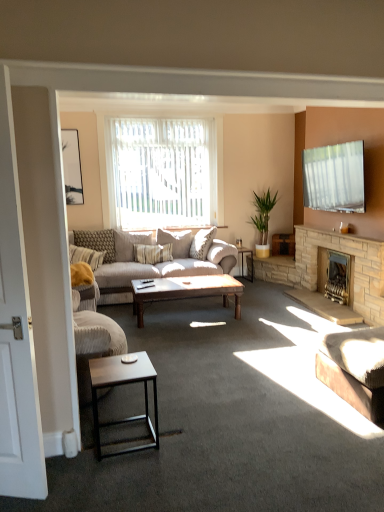
Question: In which direction should I rotate to look at textured beige pillow at center, the 2th pillow viewed from the left?

Choices:
 (A) left
 (B) right

Answer: (A)

Question: Is the depth of matte black picture frame at upper left less than that of black wood side table at center?

Choices:
 (A) yes
 (B) no

Answer: (A)

Question: Is the position of matte black picture frame at upper left more distant than that of black wood side table at center?

Choices:
 (A) yes
 (B) no

Answer: (B)

Question: From a real-world perspective, is matte black picture frame at upper left physically below black wood side table at center?

Choices:
 (A) no
 (B) yes

Answer: (A)

Question: Is matte black picture frame at upper left at the right side of black wood side table at center?

Choices:
 (A) yes
 (B) no

Answer: (B)

Question: Is matte black picture frame at upper left to the left of black wood side table at center from the viewer's perspective?

Choices:
 (A) yes
 (B) no

Answer: (A)

Question: From the image's perspective, is matte black picture frame at upper left above black wood side table at center?

Choices:
 (A) yes
 (B) no

Answer: (A)

Question: Can you confirm if wooden coffee table at center, marked as the 1th coffee table in a back-to-front arrangement, is thinner than textured beige pillow at left, the first pillow from the left?

Choices:
 (A) no
 (B) yes

Answer: (A)

Question: Could you tell me if wooden coffee table at center, acting as the 2th coffee table starting from the front, is facing textured beige pillow at left, the 3th pillow in the right-to-left sequence?

Choices:
 (A) no
 (B) yes

Answer: (A)

Question: From a real-world perspective, is wooden coffee table at center, marked as the 1th coffee table in a back-to-front arrangement, over textured beige pillow at left, the 3th pillow in the right-to-left sequence?

Choices:
 (A) no
 (B) yes

Answer: (A)

Question: Does wooden coffee table at center, acting as the 2th coffee table starting from the front, have a greater height compared to textured beige pillow at left, the first pillow from the left?

Choices:
 (A) yes
 (B) no

Answer: (B)

Question: Does wooden coffee table at center, acting as the 2th coffee table starting from the front, appear on the right side of textured beige pillow at left, the first pillow from the left?

Choices:
 (A) no
 (B) yes

Answer: (B)

Question: Does wooden coffee table at center, marked as the 1th coffee table in a back-to-front arrangement, touch textured beige pillow at left, the first pillow from the left?

Choices:
 (A) no
 (B) yes

Answer: (A)

Question: From the image's perspective, is stone fireplace at right, the 2th fireplace when ordered from back to front, above beige fabric couch at center, which ranks as the first studio couch in back-to-front order?

Choices:
 (A) yes
 (B) no

Answer: (B)